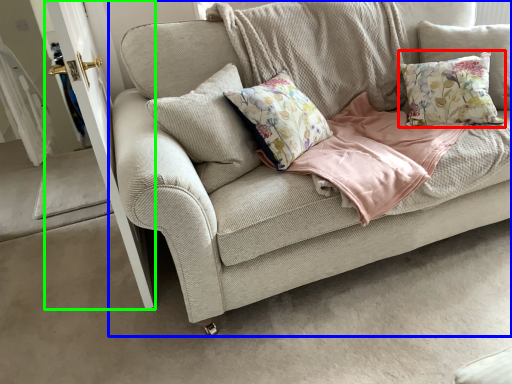
Question: Considering the real-world distances, which object is farthest from pillow (highlighted by a red box)? studio couch (highlighted by a blue box) or screen door (highlighted by a green box)?

Choices:
 (A) studio couch
 (B) screen door

Answer: (B)